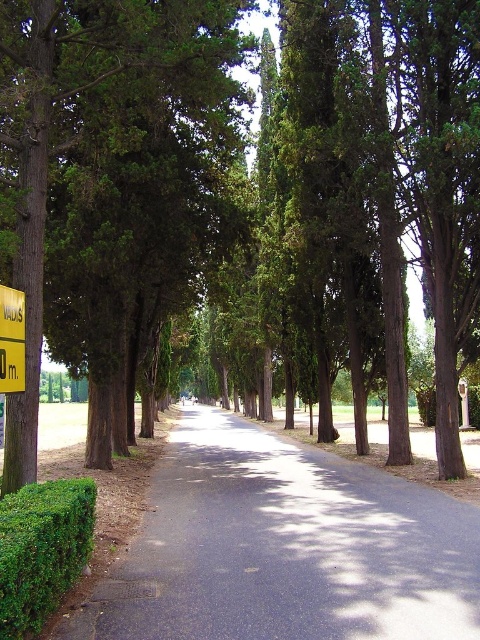
You are a gardener planning to install a new pathway in your garden. You have a 10 meter wide space available. The dark asphalt road at center and the green leafy hedge at lower left are part of your design. Which one requires more space in width?

The dark asphalt road at center requires more space in width because its width surpasses that of the green leafy hedge at lower left.

You are a photographer standing at the end of the dark asphalt road at center and want to capture the green leafy hedge at lower left in your shot. Based on their heights, will the hedge be fully visible in the photo without being blocked by the road?

The dark asphalt road at center has a greater height compared to green leafy hedge at lower left, so the road will block part of the hedge, making it not fully visible in the photo.